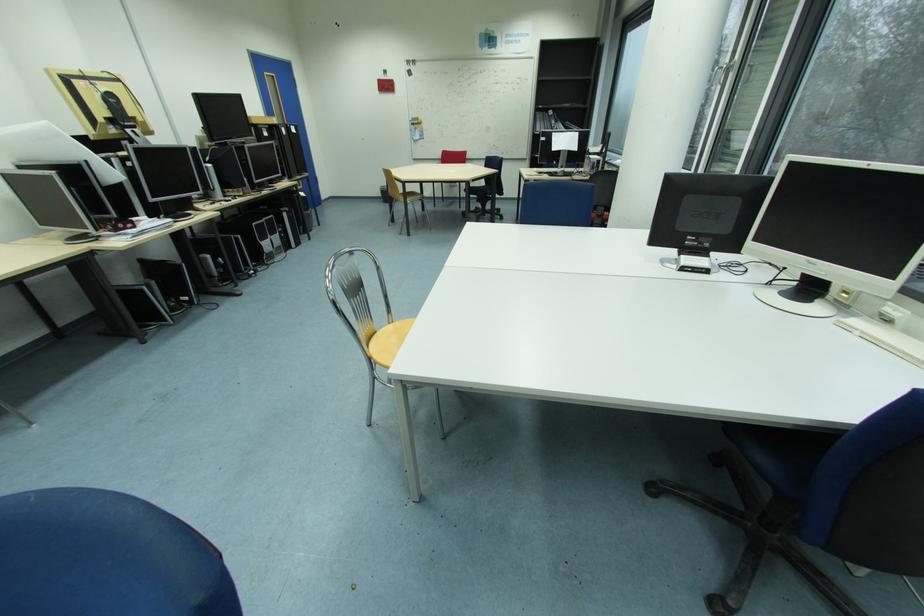
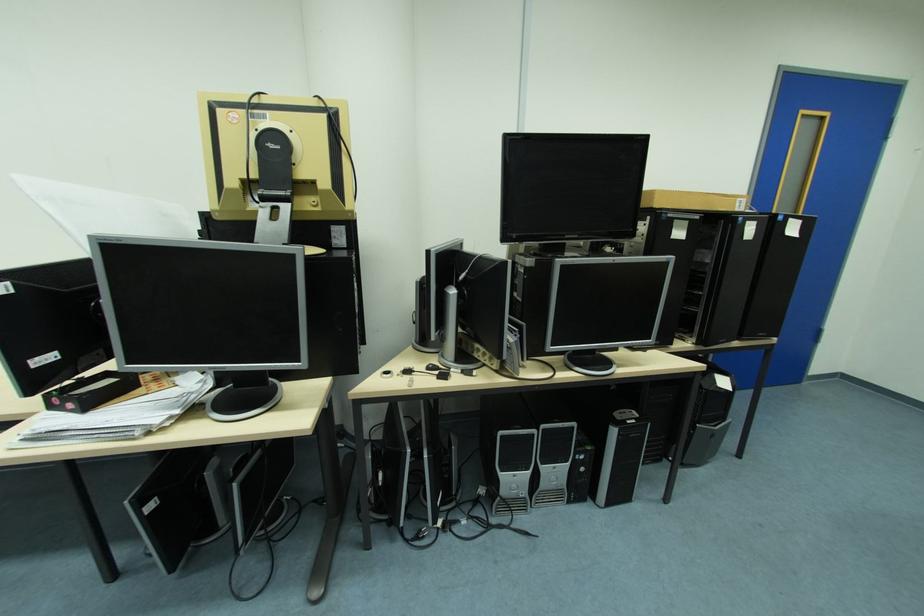
Locate, in the second image, the point that corresponds to [289,236] in the first image.

(590, 469)